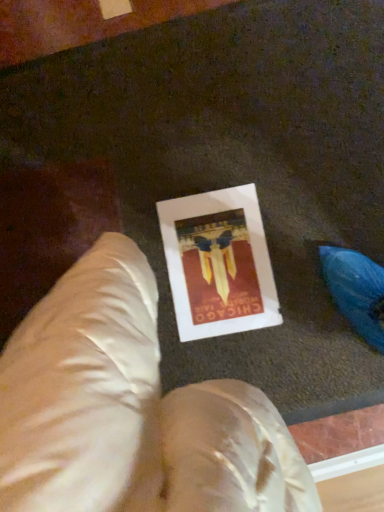
This screenshot has width=384, height=512. What do you see at coordinates (218, 263) in the screenshot? I see `white paper at center` at bounding box center [218, 263].

In order to face white paper at center, should I rotate leftwards or rightwards?

To align with it, rotate right about 3.617°.

I want to click on white paper at center, so click(x=218, y=263).

What do you see at coordinates (130, 410) in the screenshot? I see `satin beige bean bag chair at center` at bounding box center [130, 410].

I want to click on satin beige bean bag chair at center, so click(x=130, y=410).

The image size is (384, 512). Find the location of `white paper at center`. white paper at center is located at coordinates (218, 263).

Considering the positions of objects satin beige bean bag chair at center and white paper at center in the image provided, who is more to the left, satin beige bean bag chair at center or white paper at center?

Positioned to the left is satin beige bean bag chair at center.

Considering their positions, is satin beige bean bag chair at center located in front of or behind white paper at center?

Visually, satin beige bean bag chair at center is located in front of white paper at center.

Does point (266, 412) come in front of point (274, 288)?

Yes, it is in front of point (274, 288).

From the image's perspective, between satin beige bean bag chair at center and white paper at center, which one is located above?

From the image's view, white paper at center is above.

From a real-world perspective, is satin beige bean bag chair at center physically located above or below white paper at center?

satin beige bean bag chair at center is situated higher than white paper at center in the real world.

Considering the relative sizes of satin beige bean bag chair at center and white paper at center in the image provided, is satin beige bean bag chair at center thinner than white paper at center?

Correct, the width of satin beige bean bag chair at center is less than that of white paper at center.

Consider the image. Between satin beige bean bag chair at center and white paper at center, which one has more height?

Standing taller between the two is satin beige bean bag chair at center.

Considering the relative sizes of satin beige bean bag chair at center and white paper at center in the image provided, is satin beige bean bag chair at center bigger than white paper at center?

Correct, satin beige bean bag chair at center is larger in size than white paper at center.

Is satin beige bean bag chair at center outside of white paper at center?

satin beige bean bag chair at center lies outside white paper at center's area.

Are satin beige bean bag chair at center and white paper at center located far from each other?

No.

Is satin beige bean bag chair at center looking in the opposite direction of white paper at center?

No, satin beige bean bag chair at center is not facing away from white paper at center.

How different are the orientations of satin beige bean bag chair at center and white paper at center in degrees?

99.2 degrees.

The height and width of the screenshot is (512, 384). I want to click on bean bag chair that is in front of the white paper at center, so click(x=130, y=410).

Which is more to the right, white paper at center or satin beige bean bag chair at center?

Positioned to the right is white paper at center.

Is white paper at center further to the viewer compared to satin beige bean bag chair at center?

Yes, white paper at center is further from the viewer.

Between point (239, 196) and point (83, 289), which one is positioned behind?

The point (239, 196) is farther.

From the image's perspective, would you say white paper at center is positioned over satin beige bean bag chair at center?

Correct, white paper at center appears higher than satin beige bean bag chair at center in the image.

From a real-world perspective, who is located lower, white paper at center or satin beige bean bag chair at center?

In real-world perspective, white paper at center is lower.

In terms of width, does white paper at center look wider or thinner when compared to satin beige bean bag chair at center?

Considering their sizes, white paper at center looks broader than satin beige bean bag chair at center.

Can you confirm if white paper at center is taller than satin beige bean bag chair at center?

Incorrect, the height of white paper at center is not larger of that of satin beige bean bag chair at center.

Considering the sizes of white paper at center and satin beige bean bag chair at center in the image, is white paper at center bigger or smaller than satin beige bean bag chair at center?

In the image, white paper at center appears to be smaller than satin beige bean bag chair at center.

Is white paper at center outside of satin beige bean bag chair at center?

That's correct, white paper at center is outside of satin beige bean bag chair at center.

Is white paper at center placed right next to satin beige bean bag chair at center?

No, white paper at center is not next to satin beige bean bag chair at center.

Is white paper at center looking in the opposite direction of satin beige bean bag chair at center?

No, white paper at center's orientation is not away from satin beige bean bag chair at center.

What's the angular difference between white paper at center and satin beige bean bag chair at center's facing directions?

white paper at center and satin beige bean bag chair at center are facing 99.2 degrees away from each other.

How much distance is there between white paper at center and satin beige bean bag chair at center?

white paper at center and satin beige bean bag chair at center are 17.86 inches apart.

Locate an element on the screen. The width and height of the screenshot is (384, 512). bean bag chair above the white paper at center (from a real-world perspective) is located at coordinates (130, 410).

There is a white paper at center. Identify the location of bean bag chair above it (from a real-world perspective). The image size is (384, 512). (130, 410).

Locate an element on the screen. The height and width of the screenshot is (512, 384). picture frame behind the satin beige bean bag chair at center is located at coordinates (218, 263).